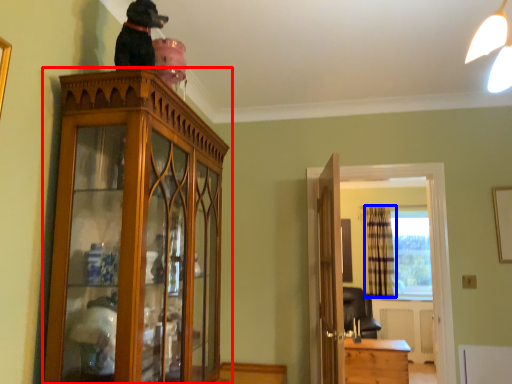
Question: Which object is further to the camera taking this photo, cabinetry (highlighted by a red box) or curtain (highlighted by a blue box)?

Choices:
 (A) cabinetry
 (B) curtain

Answer: (B)